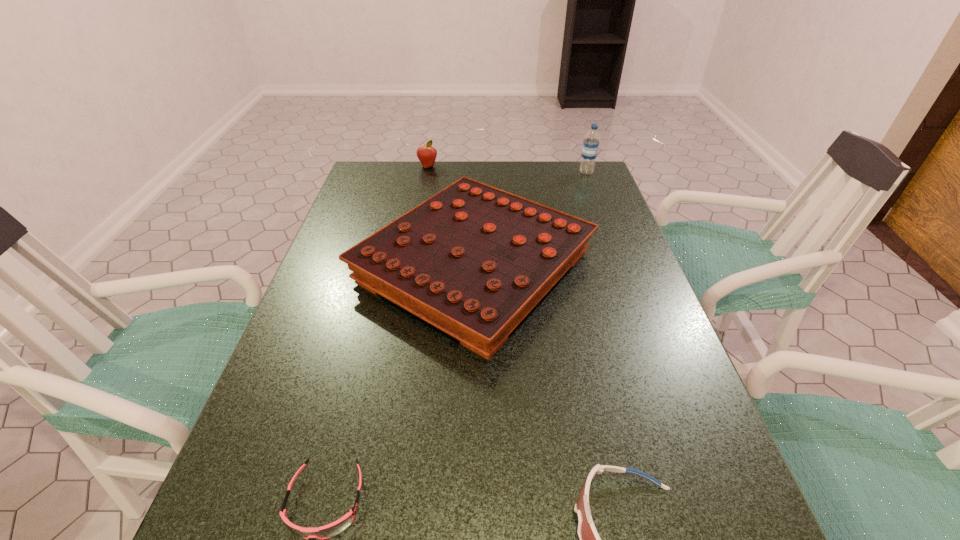
The image size is (960, 540). I want to click on apple that is at the far edge, so click(426, 154).

This screenshot has height=540, width=960. What are the coordinates of `object located in the left edge section of the desktop` in the screenshot? It's located at (473, 260).

This screenshot has height=540, width=960. Find the location of `water bottle situated at the right edge`. water bottle situated at the right edge is located at coordinates 591,142.

The image size is (960, 540). Find the location of `gameboard located at the right edge`. gameboard located at the right edge is located at coordinates (473, 260).

Locate an element on the screen. This screenshot has height=540, width=960. object that is positioned at the far right corner is located at coordinates (591, 142).

In the image, there is a desktop. Identify the location of vacant region at the far edge. (507, 185).

Where is `free location at the left edge of the desktop`? The image size is (960, 540). free location at the left edge of the desktop is located at coordinates (252, 527).

Where is `free spot at the right edge of the desktop`? The width and height of the screenshot is (960, 540). free spot at the right edge of the desktop is located at coordinates (632, 302).

The height and width of the screenshot is (540, 960). In order to click on free space between the water bottle and the apple in this screenshot , I will do `click(507, 169)`.

I want to click on free space between the water bottle and the apple, so click(507, 169).